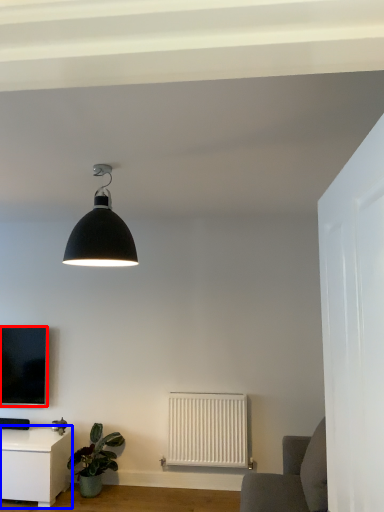
Question: Which point is closer to the camera, television (highlighted by a red box) or table (highlighted by a blue box)?

Choices:
 (A) television
 (B) table

Answer: (B)